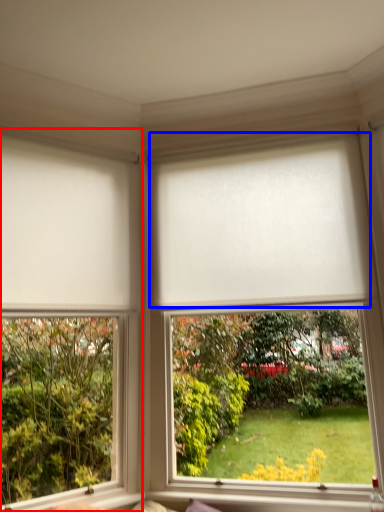
Question: Which of the following is the closest to the observer, window (highlighted by a red box) or blind (highlighted by a blue box)?

Choices:
 (A) window
 (B) blind

Answer: (A)